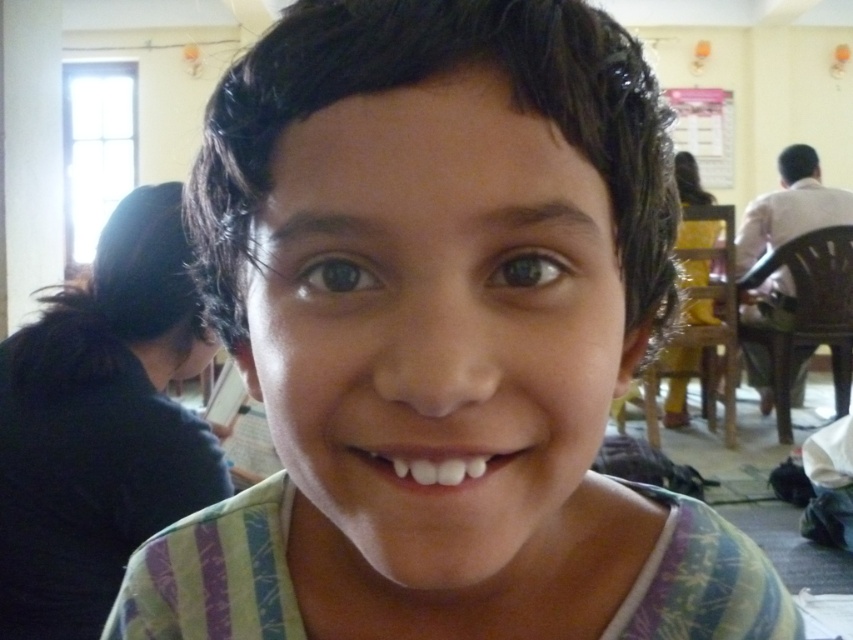
Is yellow fabric pants at right thinner than white glossy teeth at center?

No.

Between yellow fabric pants at right and white glossy teeth at center, which one appears on the left side from the viewer's perspective?

From the viewer's perspective, white glossy teeth at center appears more on the left side.

Does point (701, 189) come in front of point (413, 470)?

No, (701, 189) is further to viewer.

Locate an element on the screen. This screenshot has width=853, height=640. yellow fabric pants at right is located at coordinates (677, 384).

Between point (738, 268) and point (412, 449), which one is positioned behind?

The point (738, 268) is more distant.

Who is lower down, white shirt at right or white glossy teeth at center?

white glossy teeth at center is below.

Is point (776, 280) more distant than point (405, 468)?

Yes.

Locate an element on the screen. white shirt at right is located at coordinates (790, 208).

Does white shirt at right appear on the right side of yellow fabric pants at right?

Correct, you'll find white shirt at right to the right of yellow fabric pants at right.

The image size is (853, 640). Describe the element at coordinates (790, 208) in the screenshot. I see `white shirt at right` at that location.

Which is in front, point (788, 176) or point (683, 412)?

Positioned in front is point (788, 176).

The height and width of the screenshot is (640, 853). I want to click on white shirt at right, so click(x=790, y=208).